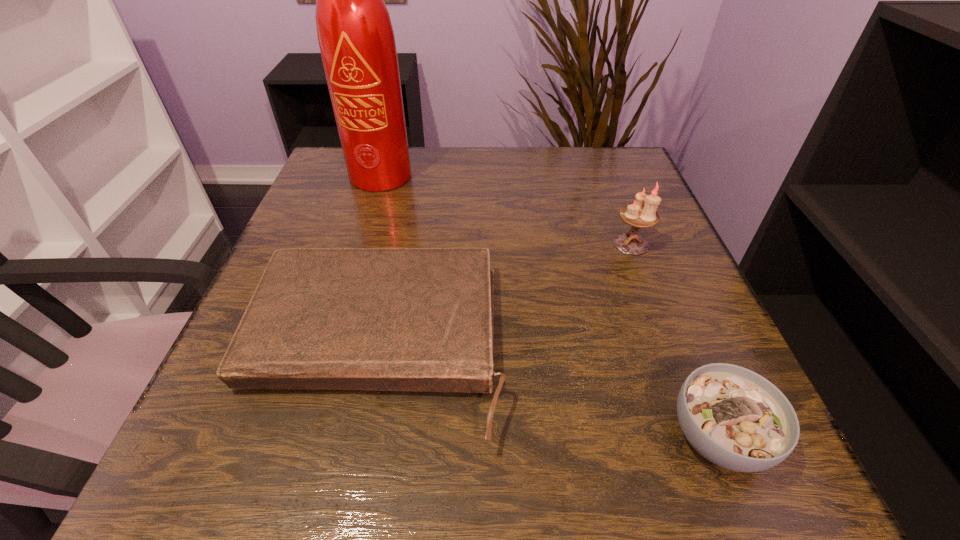
Locate an element on the screen. vacant space at the far edge of the desktop is located at coordinates (572, 181).

This screenshot has width=960, height=540. I want to click on blank area at the near edge, so (470, 496).

In the image, there is a desktop. Where is `vacant area at the left edge`? vacant area at the left edge is located at coordinates (318, 230).

Where is `vacant space at the far left corner of the desktop`? The height and width of the screenshot is (540, 960). vacant space at the far left corner of the desktop is located at coordinates (320, 182).

Where is `free space at the far right corner`? The width and height of the screenshot is (960, 540). free space at the far right corner is located at coordinates (582, 160).

I want to click on vacant space at the near right corner of the desktop, so click(x=687, y=441).

This screenshot has height=540, width=960. I want to click on vacant area between the farthest object and the candle holder, so click(508, 210).

Find the location of a particular element. vacant space that is in between the third nearest object and the paperback book is located at coordinates (503, 295).

Locate an element on the screen. The width and height of the screenshot is (960, 540). free space between the second shortest object and the third nearest object is located at coordinates (674, 340).

Where is `free space between the third tallest object and the candle holder`? The width and height of the screenshot is (960, 540). free space between the third tallest object and the candle holder is located at coordinates (674, 340).